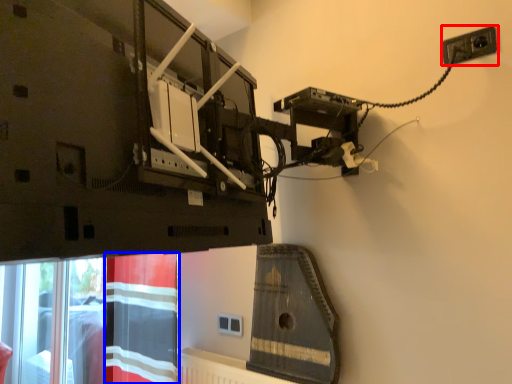
Question: Which point is further to the camera, power plugs and sockets (highlighted by a red box) or curtain (highlighted by a blue box)?

Choices:
 (A) power plugs and sockets
 (B) curtain

Answer: (B)